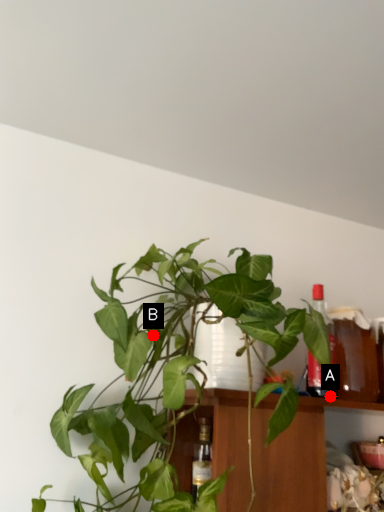
Question: Two points are circled on the image, labeled by A and B beside each circle. Which point is farther from the camera taking this photo?

Choices:
 (A) A is further
 (B) B is further

Answer: (A)